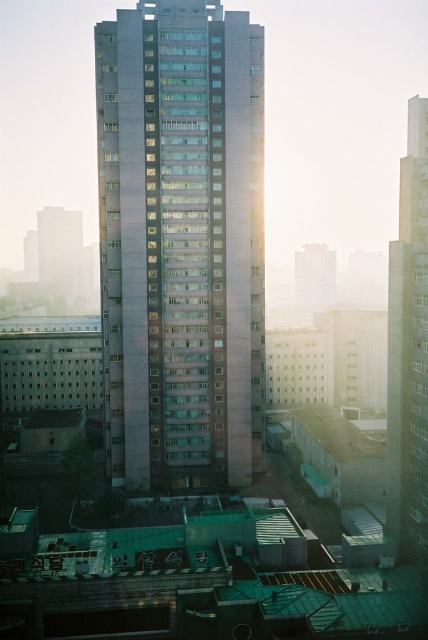
You are an architect analyzing the urban layout of this city. You need to determine the exact position of the smooth gray building at center in a coordinate system where the bottom left corner is the origin. What are its coordinates?

The smooth gray building at center is located at coordinates point (181, 243).

You are an architect analyzing the urban layout. Based on the scene, which object is narrower between the smooth gray building at center and the metallic glass skyscraper at right?

The smooth gray building at center is narrower than the metallic glass skyscraper at right.

You are a city planner assessing the urban layout. Given the distance between the smooth gray building at center and the metallic glass skyscraper at right, would a new pedestrian bridge spanning 100 feet be feasible to connect them?

The smooth gray building at center and the metallic glass skyscraper at right are 106.70 feet apart. A 100 feet pedestrian bridge would not be sufficient to span the distance between them, as it is shorter than the required gap.